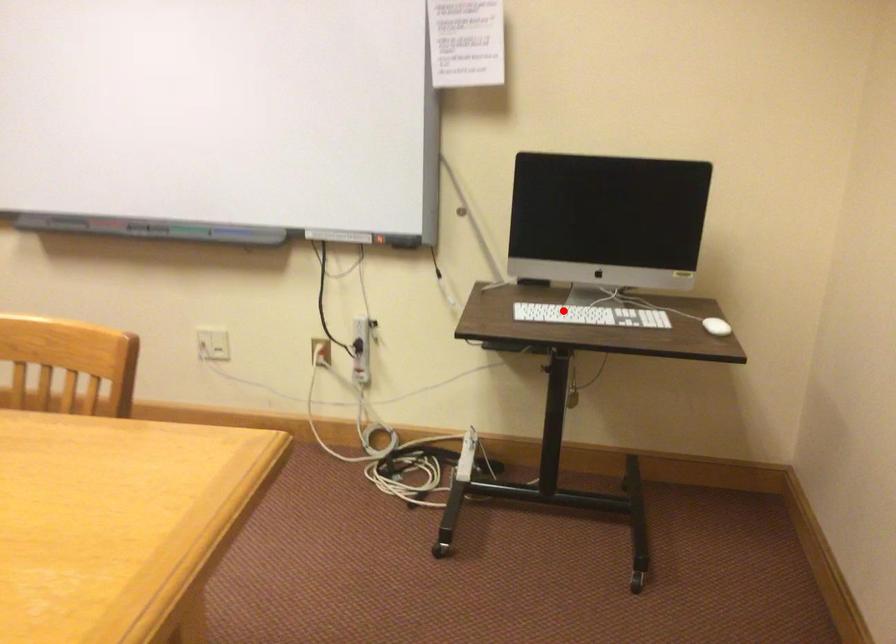
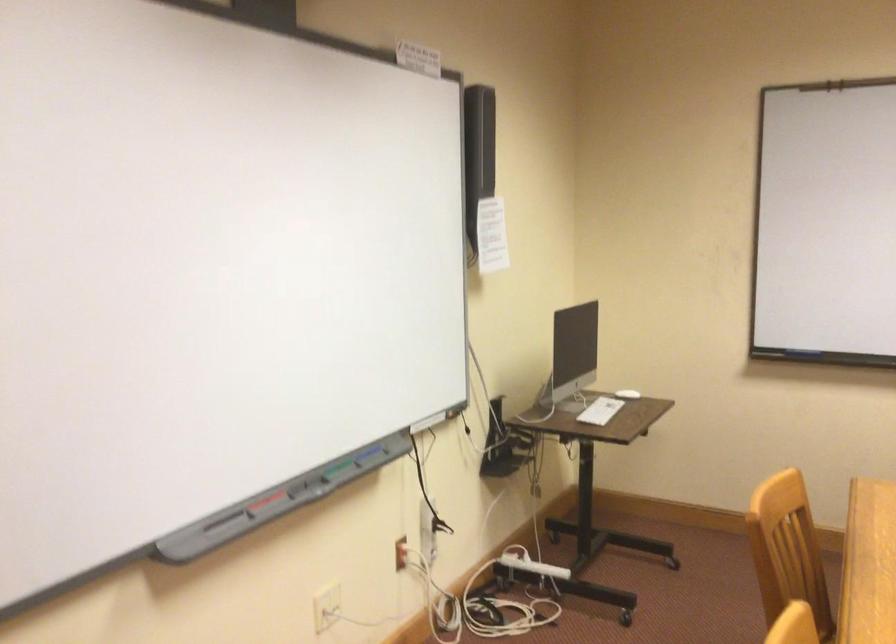
In the second image, find the point that corresponds to the highlighted location in the first image.

(600, 410)